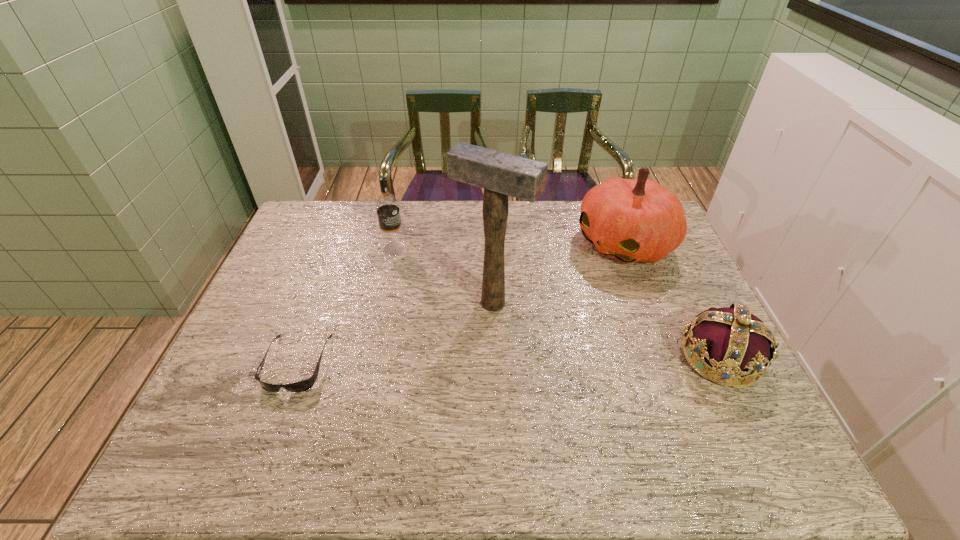
Find the location of a particular element. The width and height of the screenshot is (960, 540). vacant point located between the crown and the pumpkin is located at coordinates (673, 301).

The width and height of the screenshot is (960, 540). Find the location of `free spot between the sunglasses and the third object from left to right`. free spot between the sunglasses and the third object from left to right is located at coordinates (395, 333).

The height and width of the screenshot is (540, 960). Find the location of `free space between the second shortest object and the third object from left to right`. free space between the second shortest object and the third object from left to right is located at coordinates (607, 330).

This screenshot has width=960, height=540. Find the location of `free space between the mallet and the second shortest object`. free space between the mallet and the second shortest object is located at coordinates (607, 330).

Identify the location of object identified as the closest to the crown. This screenshot has width=960, height=540. (633, 220).

Identify which object is the second nearest to the fourth object from right to left. Please provide its 2D coordinates. Your answer should be formatted as a tuple, i.e. [(x, y)], where the tuple contains the x and y coordinates of a point satisfying the conditions above.

[(304, 385)]

Identify the location of free space that satisfies the following two spatial constraints: 1. on the front side of the fourth tallest object; 2. on the right side of the pumpkin. This screenshot has width=960, height=540. (667, 358).

This screenshot has width=960, height=540. Identify the location of vacant area in the image that satisfies the following two spatial constraints: 1. on the front side of the tallest object; 2. on the right side of the vodka. (382, 303).